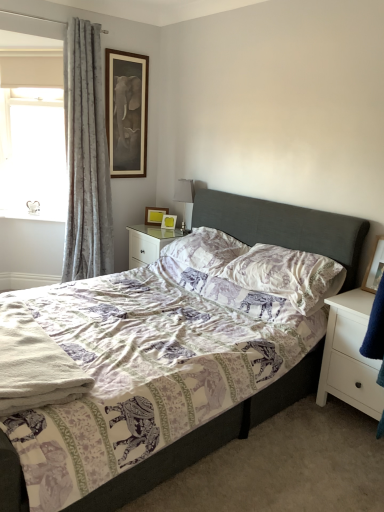
Question: Which direction should I rotate to look at wooden picture frame at upper center, which ranks as the second picture frame in right-to-left order?

Choices:
 (A) left
 (B) right

Answer: (A)

Question: Can you confirm if white glossy nightstand at center, the first nightstand from the left, is bigger than matte wooden picture frame at upper center, which is counted as the 4th picture frame, starting from the right?

Choices:
 (A) no
 (B) yes

Answer: (B)

Question: Is white glossy nightstand at center, which is counted as the second nightstand, starting from the bottom, wider than matte wooden picture frame at upper center, arranged as the 1th picture frame when viewed from the left?

Choices:
 (A) yes
 (B) no

Answer: (A)

Question: From the image's perspective, would you say white glossy nightstand at center, the first nightstand from the left, is shown under matte wooden picture frame at upper center, the third picture frame positioned from the back?

Choices:
 (A) yes
 (B) no

Answer: (A)

Question: Is white glossy nightstand at center, which ranks as the second nightstand in front-to-back order, not within matte wooden picture frame at upper center, which is the 4th picture frame in bottom-to-top order?

Choices:
 (A) yes
 (B) no

Answer: (A)

Question: Can you confirm if white glossy nightstand at center, which ranks as the second nightstand in front-to-back order, is shorter than matte wooden picture frame at upper center, which is the 4th picture frame in bottom-to-top order?

Choices:
 (A) no
 (B) yes

Answer: (B)

Question: Is white glossy nightstand at center, the first nightstand viewed from the back, directly adjacent to matte wooden picture frame at upper center, which is the 4th picture frame in bottom-to-top order?

Choices:
 (A) no
 (B) yes

Answer: (A)

Question: Is white soft towel at lower left positioned with its back to silver metallic table lamp at upper center?

Choices:
 (A) yes
 (B) no

Answer: (B)

Question: From a real-world perspective, is white soft towel at lower left located higher than silver metallic table lamp at upper center?

Choices:
 (A) yes
 (B) no

Answer: (B)

Question: Is white soft towel at lower left wider than silver metallic table lamp at upper center?

Choices:
 (A) no
 (B) yes

Answer: (B)

Question: Is white soft towel at lower left bigger than silver metallic table lamp at upper center?

Choices:
 (A) yes
 (B) no

Answer: (A)

Question: Is white soft towel at lower left far from silver metallic table lamp at upper center?

Choices:
 (A) yes
 (B) no

Answer: (A)

Question: From the image's perspective, is white soft towel at lower left under silver metallic table lamp at upper center?

Choices:
 (A) yes
 (B) no

Answer: (A)

Question: From the image's perspective, does wooden picture frame at upper center, marked as the 3th picture frame in a top-to-bottom arrangement, appear lower than white matte nightstand at right, which is the first nightstand in bottom-to-top order?

Choices:
 (A) no
 (B) yes

Answer: (A)